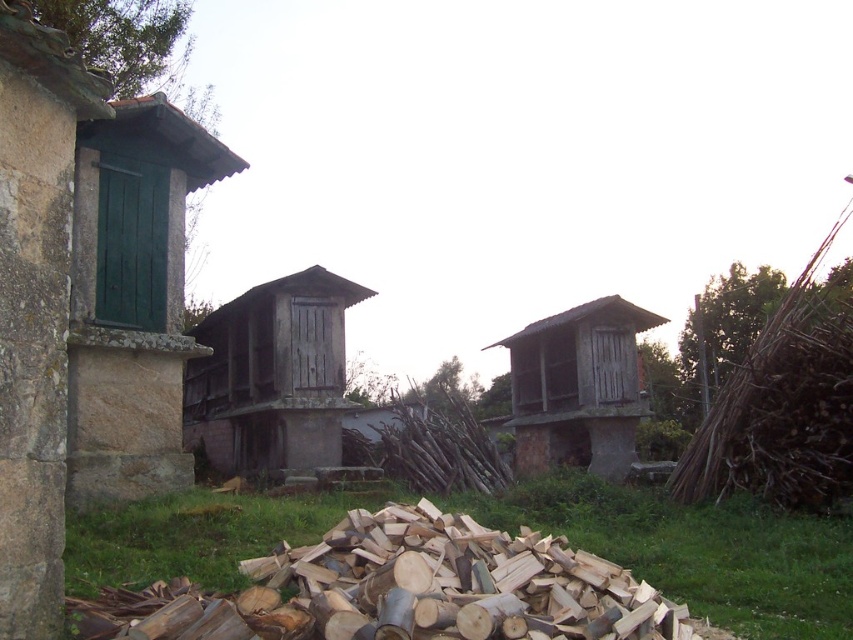
You are standing at the viewpoint of the image and see two points marked in the scene. Which point is closer to you, point (70, 356) or point (238, 323)?

Point (70, 356) is in front of point (238, 323), so it is closer to you.

You are a visitor trying to find the tallest structure in the scene. You see a weathered wood hut at center and a wooden hut at center. Which one is taller?

The wooden hut at center is taller than the weathered wood hut at center.

You are standing at point (271, 376) in the image. What structure are you directly at?

You are directly at the weathered wood hut at center located at point (271, 376).